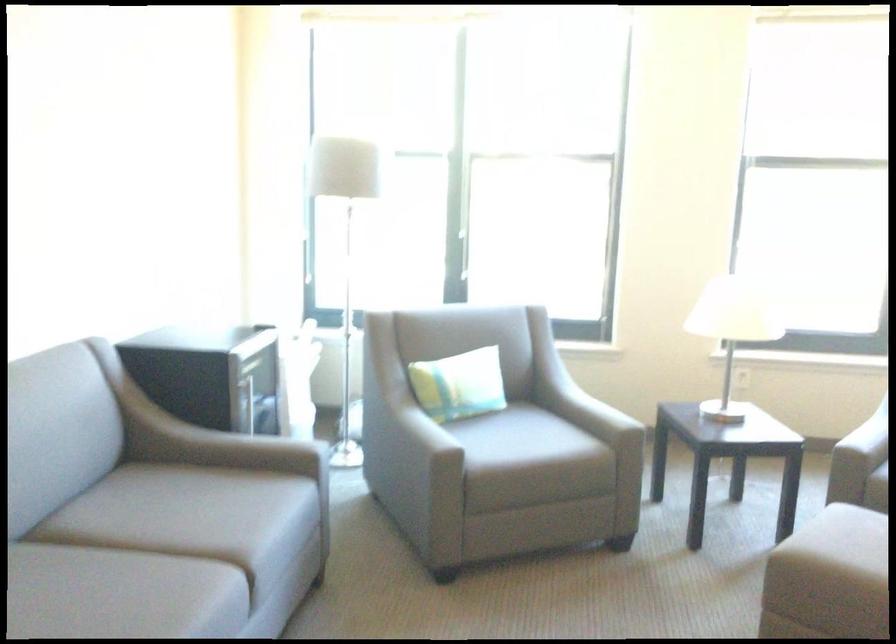
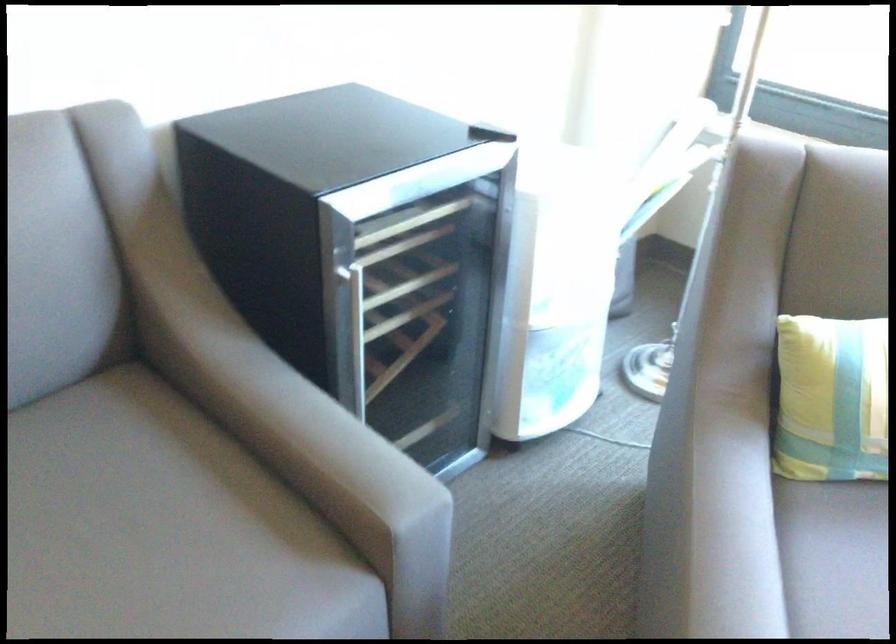
Question: I am providing you with two images of the same scene from different viewpoints. Which of the following objects are not visible in image2?

Choices:
 (A) striped small pillow
 (B) grey chair sitting surface
 (C) grey chair armrest
 (D) none of these

Answer: (D)